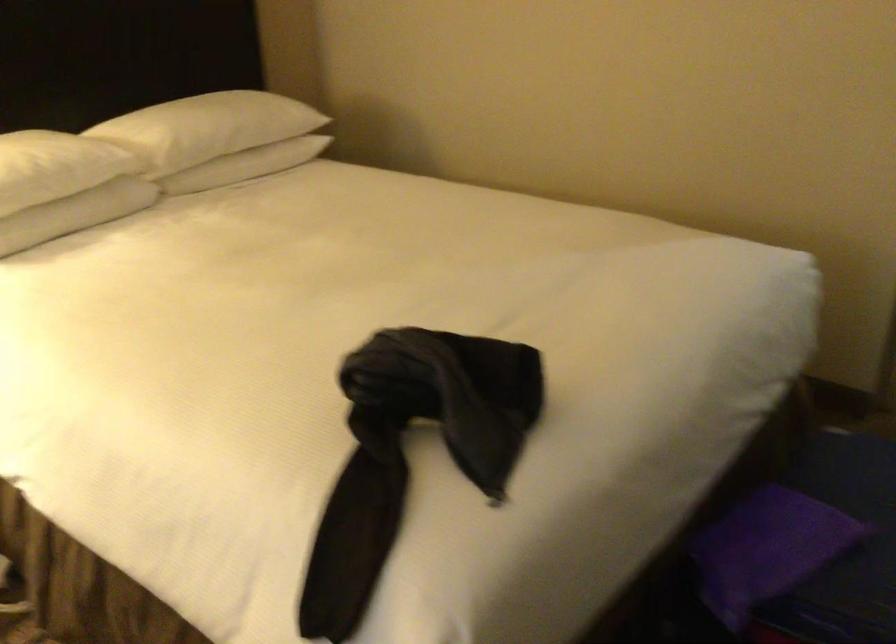
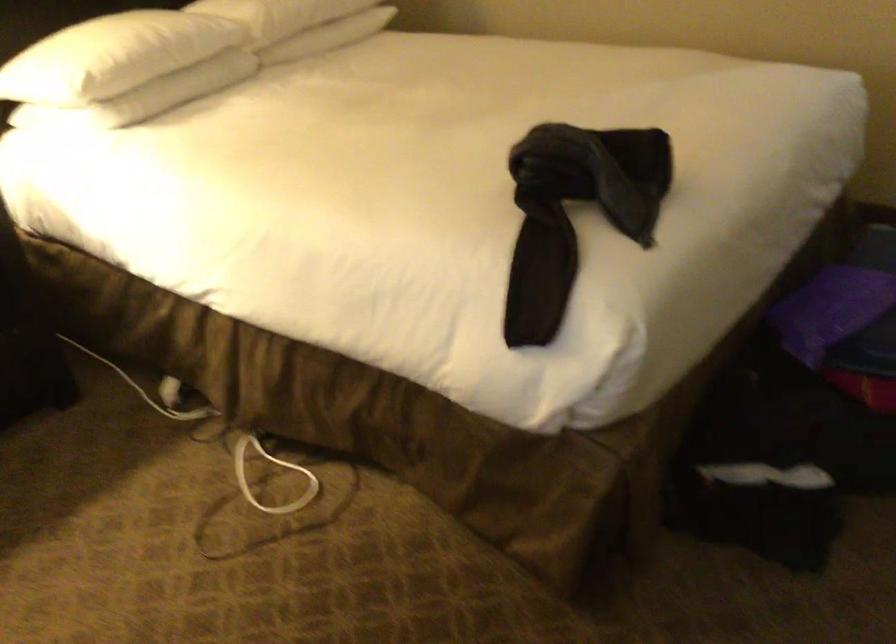
Locate, in the second image, the point that corresponds to (x=419, y=442) in the first image.

(574, 212)